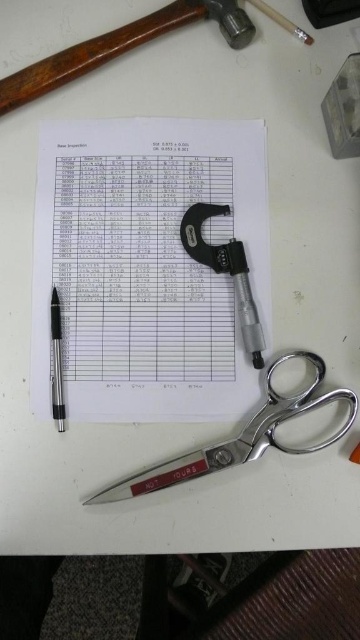
You are an inspector who needs to record measurements on the printed sheet of paper. You have a matte black micrometer at center and a metallic silver pen at left. Which tool should you pick up first to ensure you can reach the sheet without moving the other tool?

The matte black micrometer at center is located above the metallic silver pen at left. Since the micrometer is above the pen, you should pick up the metallic silver pen at left first to avoid blocking access to the micrometer when reaching for the sheet.